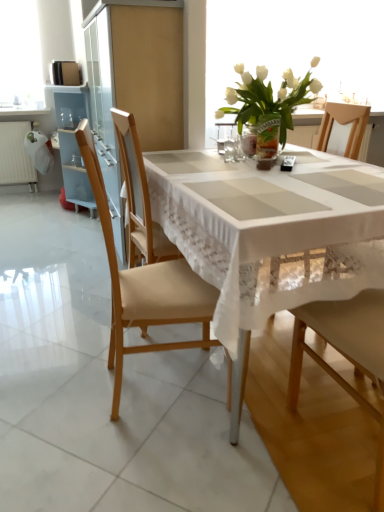
Locate an element on the screen. The width and height of the screenshot is (384, 512). free spot to the right of translucent glass vase at center is located at coordinates (315, 159).